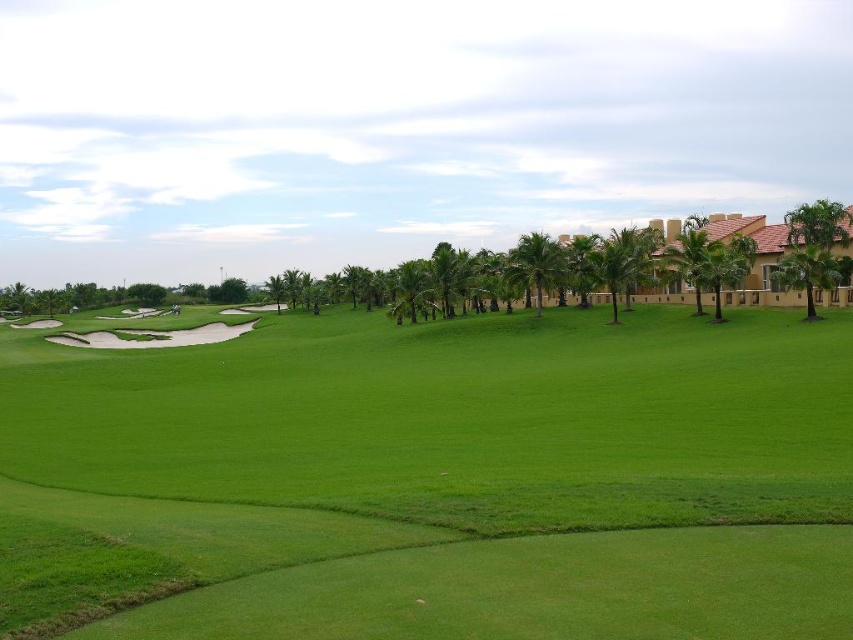
Looking at this image, you are a golfer standing at the tee box and see two points on the golf course labeled as point (x=799, y=216) and point (x=538, y=232). Which point is closer to your current position?

Point (x=799, y=216) is closer to the viewer than point (x=538, y=232), so the point labeled as point (x=799, y=216) is closer to your current position.